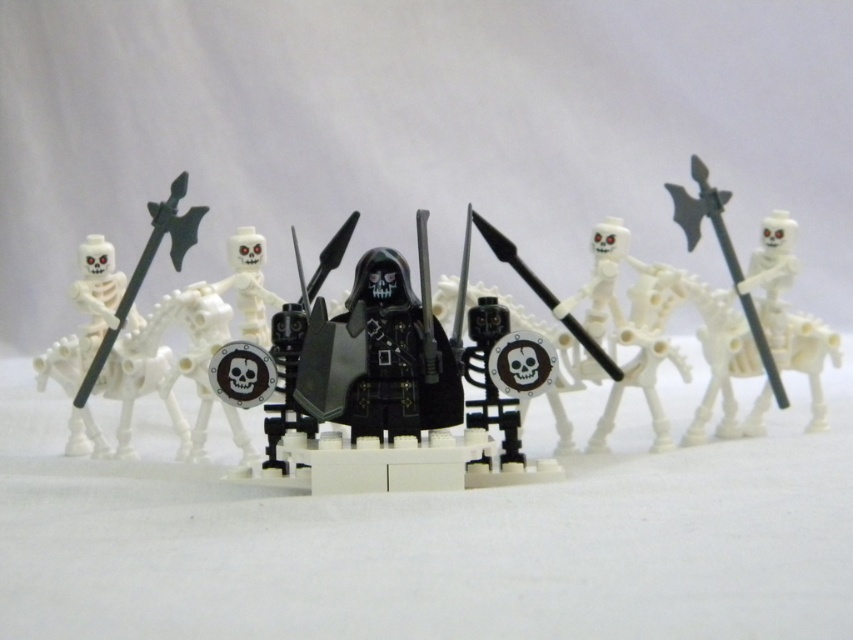
You are a warrior in the image and need to grab a weapon. You see a black plastic spear at left and a smooth white skeleton at center. Which weapon is closer to your right side?

The smooth white skeleton at center is positioned to the right of the black plastic spear at left, so the black plastic spear at left is on the left side and the smooth white skeleton at center is on the right side. Therefore, the smooth white skeleton at center is closer to your right side.

You are a LEGO figure standing at the center of the formation. You need to locate the point at coordinate point (723, 257). Where would you find this point?

The point at coordinate (723, 257) is located on the black plastic axe at right.

You are a collector who wants to display the black matte armor at center and the black plastic spear at center on a shelf. If the shelf has a maximum width of 15 cm, can both items fit side by side?

The black matte armor at center is bigger than the black plastic spear at center, but their exact sizes aren not provided. Without knowing their individual dimensions, it is impossible to determine if they will fit on a 15 cm shelf together.